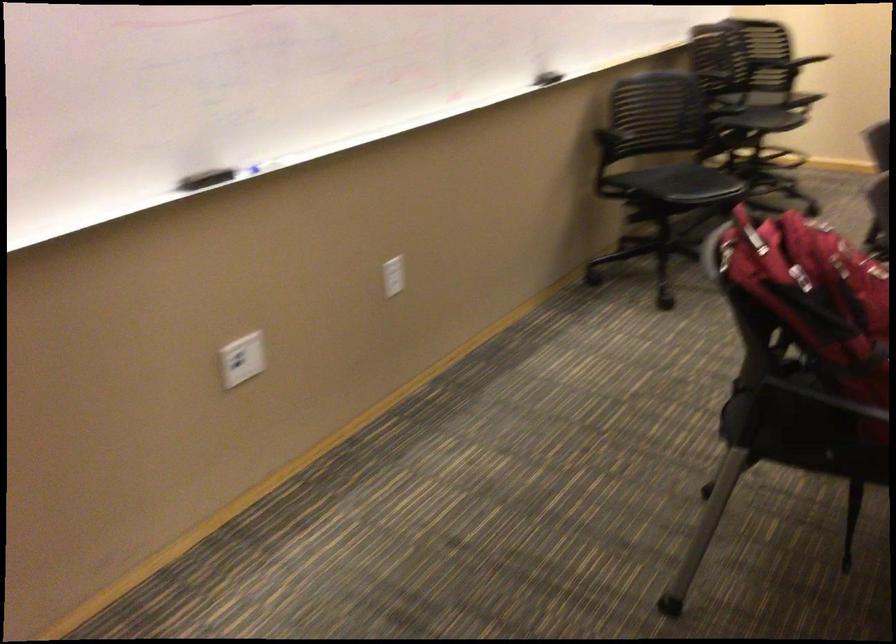
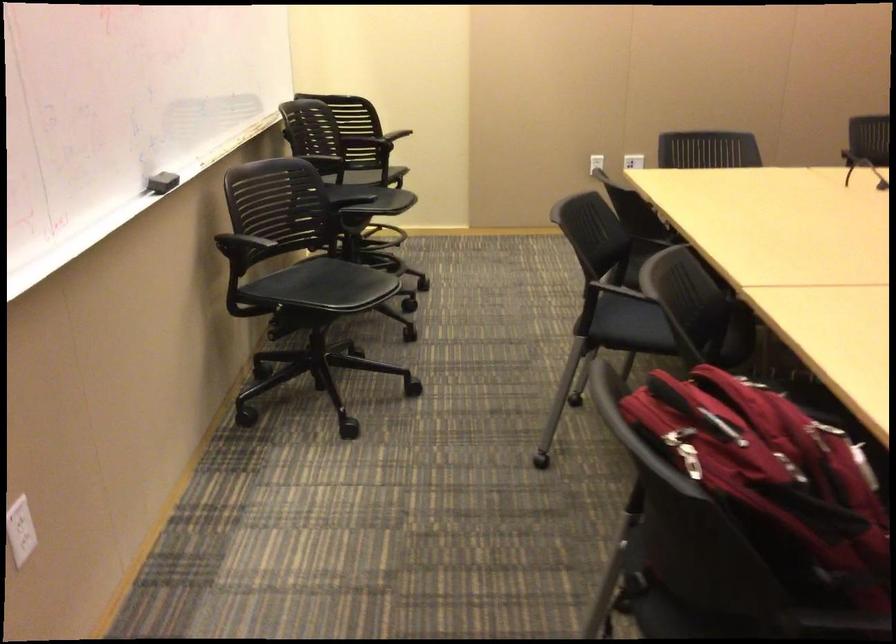
Where in the second image is the point corresponding to (x=741, y=257) from the first image?

(690, 460)